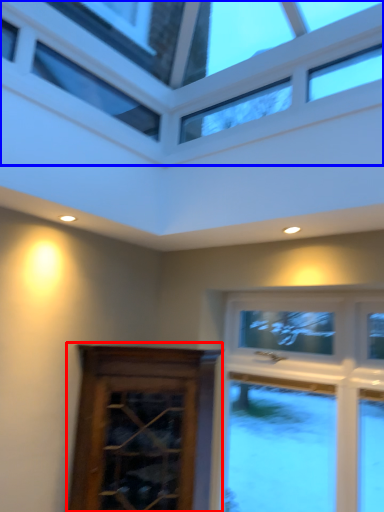
Question: Which point is closer to the camera, screen door (highlighted by a red box) or window (highlighted by a blue box)?

Choices:
 (A) screen door
 (B) window

Answer: (B)